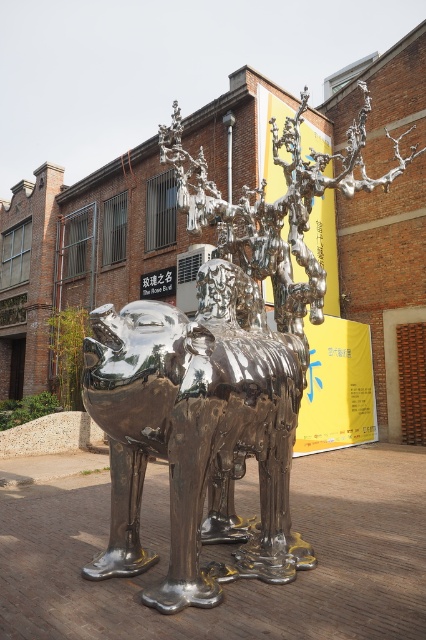
You are a photographer standing in front of the sculpture. You want to capture both the shiny metallic camel at center and the green leafy plant at left in a single photo. Which object should you focus on first to ensure both are in frame?

The shiny metallic camel at center is located above the green leafy plant at left, so you should focus on the shiny metallic camel at center first to ensure both are in frame.

You are a photographer standing in front of the shiny metallic camel at center. You want to take a photo of it but need to ensure you are far enough away so that the entire sculpture fits in your camera frame. The camera you are using has a maximum field of view that can capture objects up to 3 meters away. Is your current position sufficient to capture the entire sculpture in one shot?

The distance between the shiny metallic camel at center and the camera is 2.90 meters, which is within the camera maximum field of view of 3 meters. Therefore, the photographer can capture the entire sculpture in one shot from the current position.